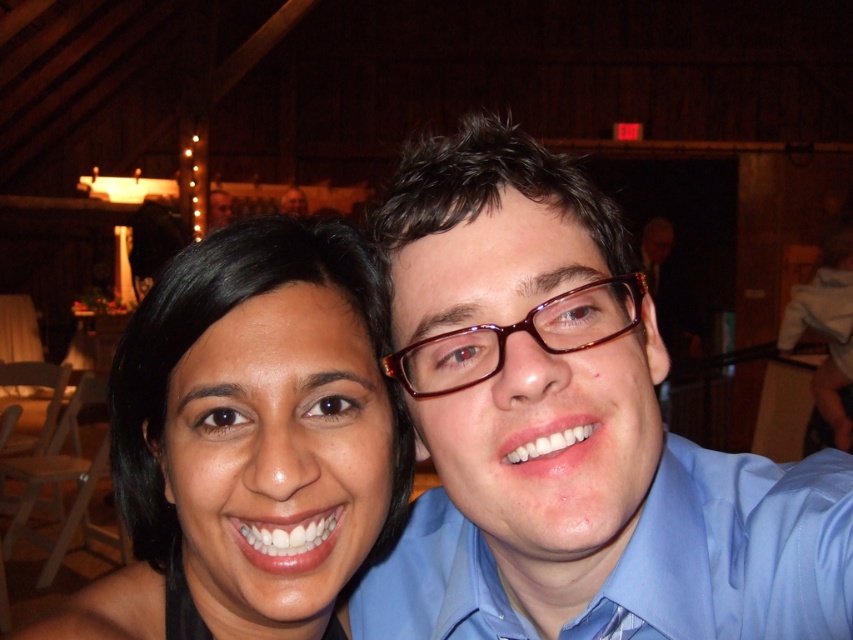
You are a photographer trying to focus on the matte blue shirt at center and the shiny brown glasses at center in this photo. Which object should you adjust your focus settings for if you want to capture the one that takes up more vertical space?

The matte blue shirt at center has a greater height compared to the shiny brown glasses at center, so you should adjust your focus settings for the matte blue shirt at center to capture the one that takes up more vertical space.

You are a photographer adjusting your camera settings to focus on the matte blue shirt at center and the smooth skin face at center in the image. Which object should you focus on first to ensure proper depth of field?

The matte blue shirt at center is in front of the smooth skin face at center, so focusing on the matte blue shirt at center first will ensure proper depth of field.

You are a photographer reviewing this image. You want to ensure both the smooth skin face at center and the shiny brown glasses at center are clearly visible in the final photo. Given their sizes in the image, which one might require more careful adjustment to avoid being too small?

The shiny brown glasses at center might require more careful adjustment because it is smaller in size than the smooth skin face at center, so it could be harder to see clearly if not properly framed.